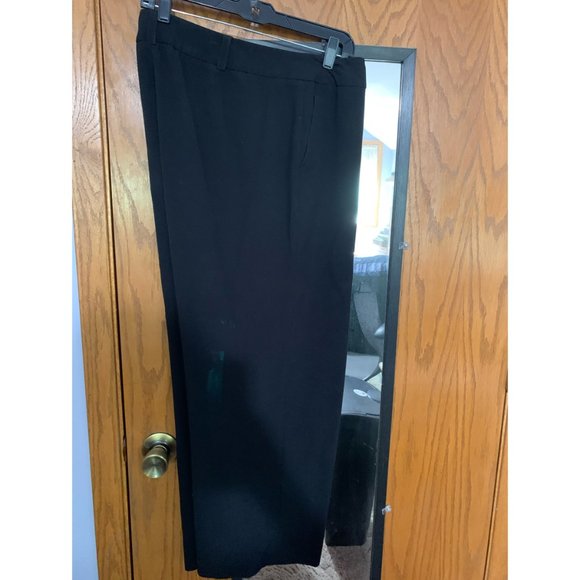
Locate an element on the screen. Image resolution: width=580 pixels, height=580 pixels. mirror is located at coordinates (380, 94).